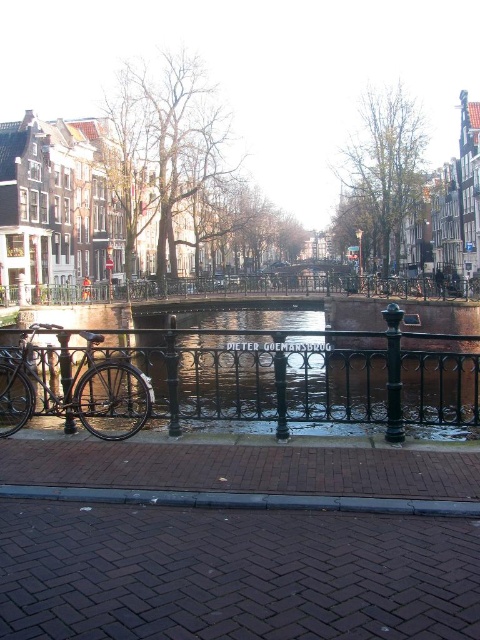
Question: Among these objects, which one is farthest from the camera?

Choices:
 (A) shiny black bicycle at left
 (B) black wrought iron fence at center

Answer: (B)

Question: Which point appears closest to the camera in this image?

Choices:
 (A) (387, 292)
 (B) (23, 595)
 (C) (112, 374)

Answer: (B)

Question: Does brick pavement at lower center have a greater width compared to black wrought iron fence at center?

Choices:
 (A) no
 (B) yes

Answer: (A)

Question: Can you confirm if dark brick pavement at lower center is bigger than black wrought iron fence at center?

Choices:
 (A) no
 (B) yes

Answer: (A)

Question: Which point appears farthest from the camera in this image?

Choices:
 (A) (231, 493)
 (B) (141, 298)
 (C) (278, 580)
 (D) (13, 396)

Answer: (B)

Question: Can you confirm if dark brick pavement at lower center is thinner than shiny black bicycle at left?

Choices:
 (A) yes
 (B) no

Answer: (B)